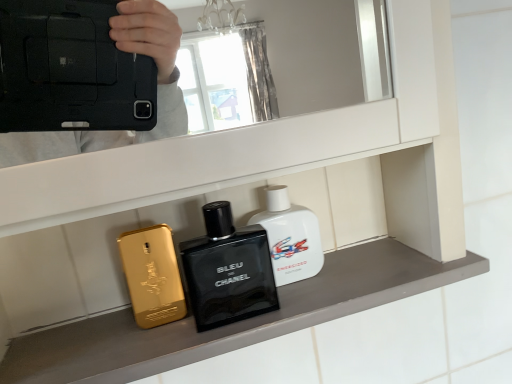
Question: Is white glossy bottle at center, the first perfume positioned from the right, turned away from black glass perfume at center?

Choices:
 (A) no
 (B) yes

Answer: (A)

Question: Is white glossy bottle at center, the first perfume positioned from the right, outside black glass perfume at center?

Choices:
 (A) yes
 (B) no

Answer: (A)

Question: Does white glossy bottle at center, the first perfume positioned from the right, have a smaller size compared to black glass perfume at center?

Choices:
 (A) no
 (B) yes

Answer: (B)

Question: From a real-world perspective, is white glossy bottle at center, the first perfume positioned from the right, positioned over black glass perfume at center based on gravity?

Choices:
 (A) no
 (B) yes

Answer: (B)

Question: Is white glossy bottle at center, the first perfume positioned from the right, closer to the viewer compared to black glass perfume at center?

Choices:
 (A) yes
 (B) no

Answer: (B)

Question: Considering the positions of point (237, 317) and point (147, 246), is point (237, 317) closer or farther from the camera than point (147, 246)?

Choices:
 (A) closer
 (B) farther

Answer: (A)

Question: Looking at their shapes, would you say black glass perfume at center is wider or thinner than gold metallic phone at left, positioned as the first perfume in left-to-right order?

Choices:
 (A) thin
 (B) wide

Answer: (B)

Question: In terms of height, does black glass perfume at center look taller or shorter compared to gold metallic phone at left, positioned as the first perfume in left-to-right order?

Choices:
 (A) tall
 (B) short

Answer: (A)

Question: From a real-world perspective, is black glass perfume at center above or below gold metallic phone at left, positioned as the first perfume in left-to-right order?

Choices:
 (A) below
 (B) above

Answer: (B)

Question: Considering the positions of black glass perfume at center and white glossy bottle at center, the first perfume positioned from the right, in the image, is black glass perfume at center taller or shorter than white glossy bottle at center, the first perfume positioned from the right,?

Choices:
 (A) short
 (B) tall

Answer: (B)

Question: From the image's perspective, relative to white glossy bottle at center, the first perfume positioned from the right, is black glass perfume at center above or below?

Choices:
 (A) above
 (B) below

Answer: (B)

Question: Does point (217, 251) appear closer or farther from the camera than point (291, 231)?

Choices:
 (A) farther
 (B) closer

Answer: (A)

Question: Is black glass perfume at center wider or thinner than white glossy bottle at center, the 2th perfume in the left-to-right sequence?

Choices:
 (A) wide
 (B) thin

Answer: (A)

Question: Relative to black glass perfume at center, is white glossy bottle at center, the 2th perfume in the left-to-right sequence, in front or behind?

Choices:
 (A) behind
 (B) front

Answer: (A)

Question: Is white glossy bottle at center, the first perfume positioned from the right, wider or thinner than black glass perfume at center?

Choices:
 (A) wide
 (B) thin

Answer: (B)